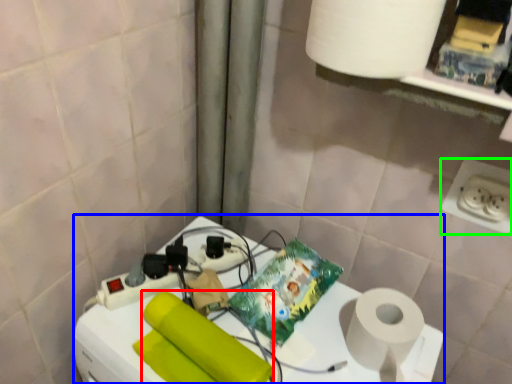
Question: Considering the real-world distances, which object is closest to toilet paper (highlighted by a red box)? appliance (highlighted by a blue box) or power plugs and sockets (highlighted by a green box).

Choices:
 (A) appliance
 (B) power plugs and sockets

Answer: (A)